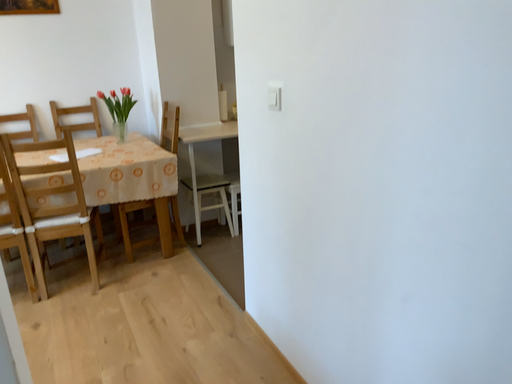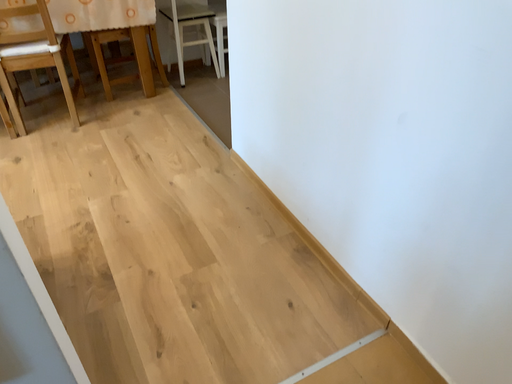
Question: Which way did the camera rotate in the video?

Choices:
 (A) rotated downward
 (B) rotated upward

Answer: (A)